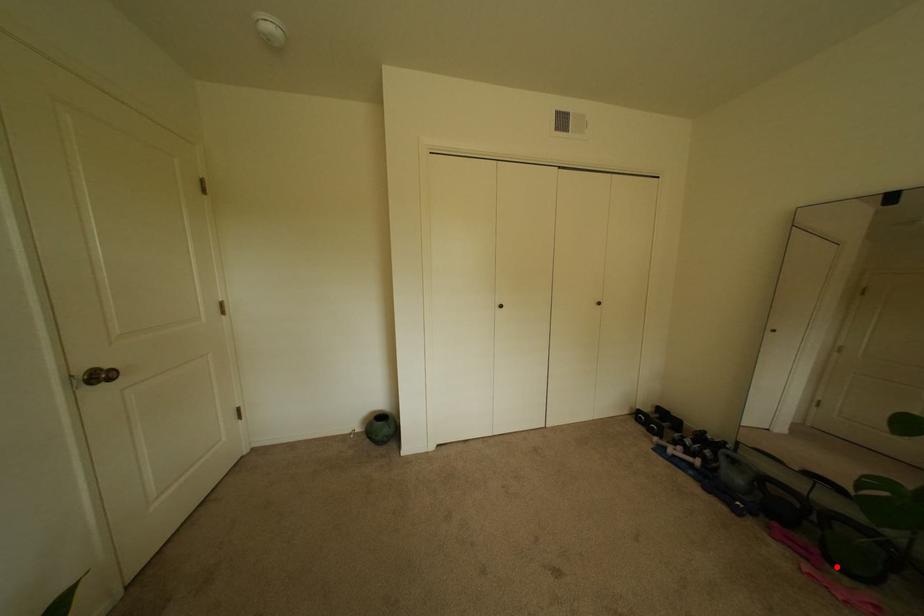
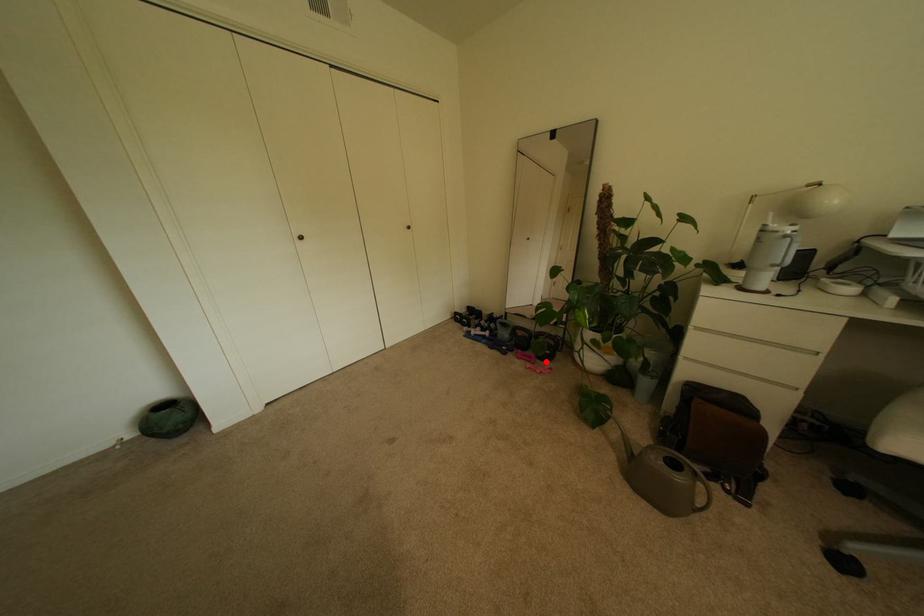
I am providing you with two images of the same scene from different viewpoints. A red point is marked on the first image and another point is marked on the second image. Is the marked point in image1 the same physical position as the marked point in image2?

Yes